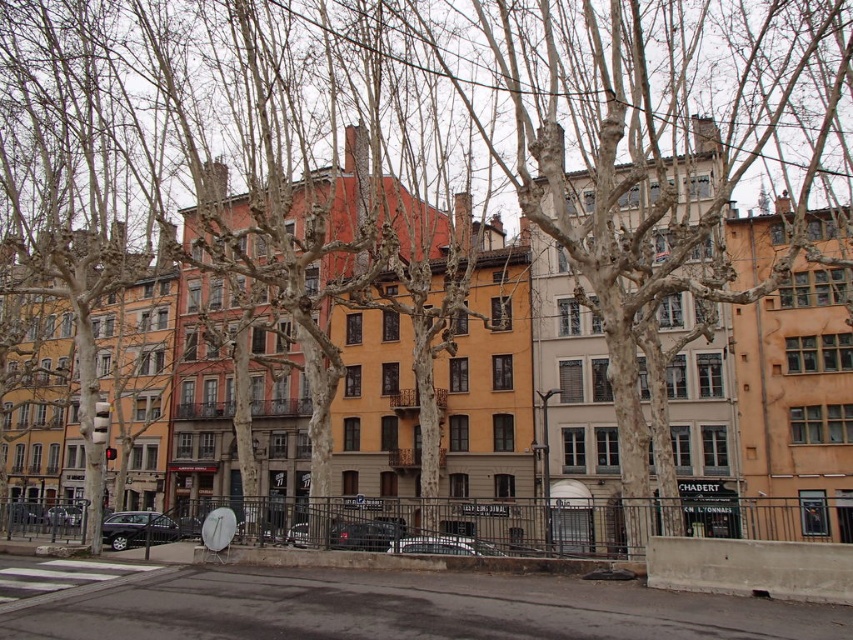
What are the coordinates of `shiny black car at center` in the screenshot? It's located at pos(361,536).

Can you confirm if shiny black car at center is shorter than matte black car at lower left?

No.

Who is more forward, (341, 544) or (45, 513)?

Point (341, 544) is more forward.

Image resolution: width=853 pixels, height=640 pixels. What are the coordinates of `shiny black car at center` in the screenshot? It's located at (361, 536).

From the picture: Does shiny black sedan at lower left have a larger size compared to shiny black car at center?

Yes.

Locate an element on the screen. shiny black sedan at lower left is located at coordinates (137, 529).

Who is shorter, shiny black sedan at lower left or metallic silver car at center?

metallic silver car at center is shorter.

Is shiny black sedan at lower left behind metallic silver car at center?

Yes, it is behind metallic silver car at center.

Who is more distant from viewer, (158,540) or (451,550)?

The point (158,540) is more distant.

At what (x,y) coordinates should I click in order to perform the action: click on shiny black sedan at lower left. Please return your answer as a coordinate pair (x, y). This screenshot has height=640, width=853. Looking at the image, I should click on (137, 529).